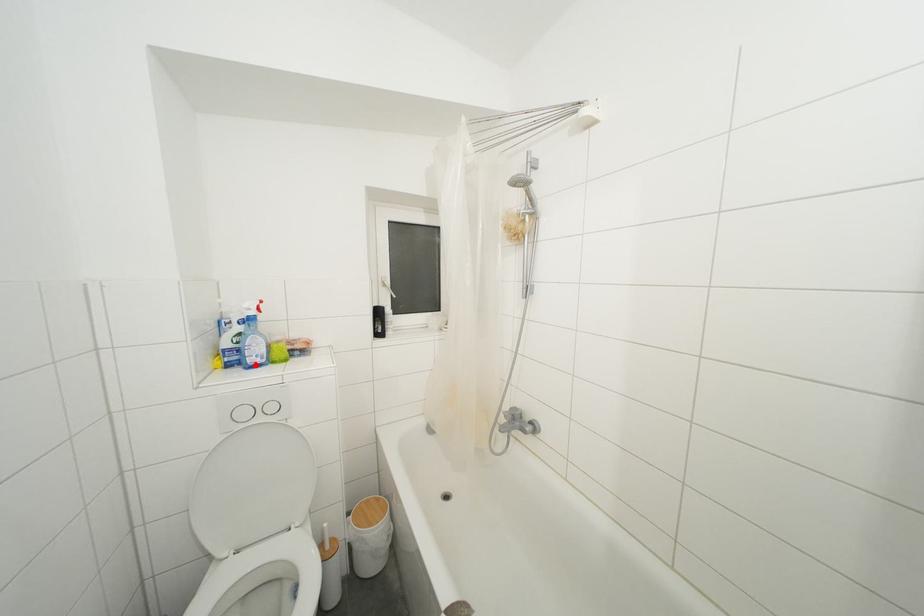
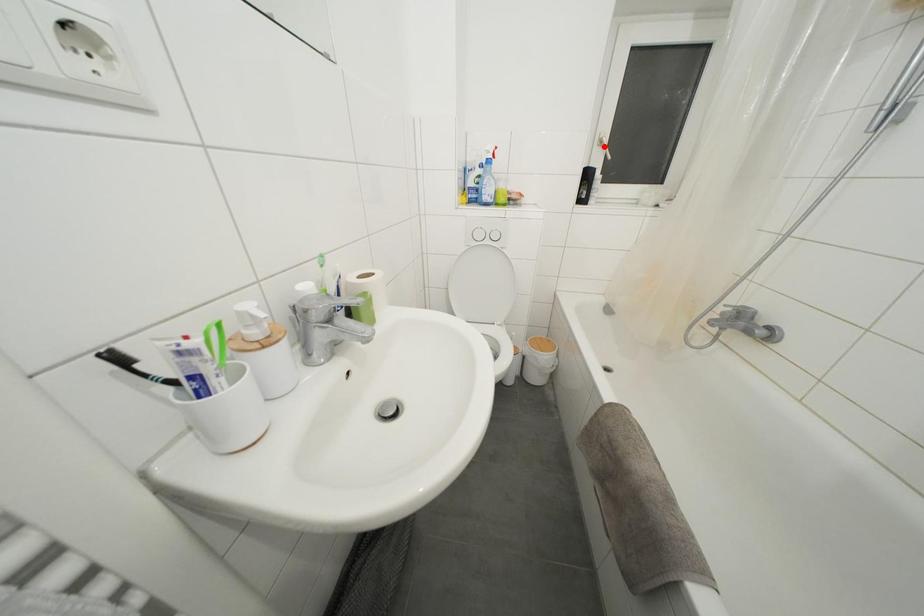
I am providing you with two images of the same scene from different viewpoints. A red point is marked on the first image and another point is marked on the second image. Do the highlighted points in image1 and image2 indicate the same real-world spot?

No